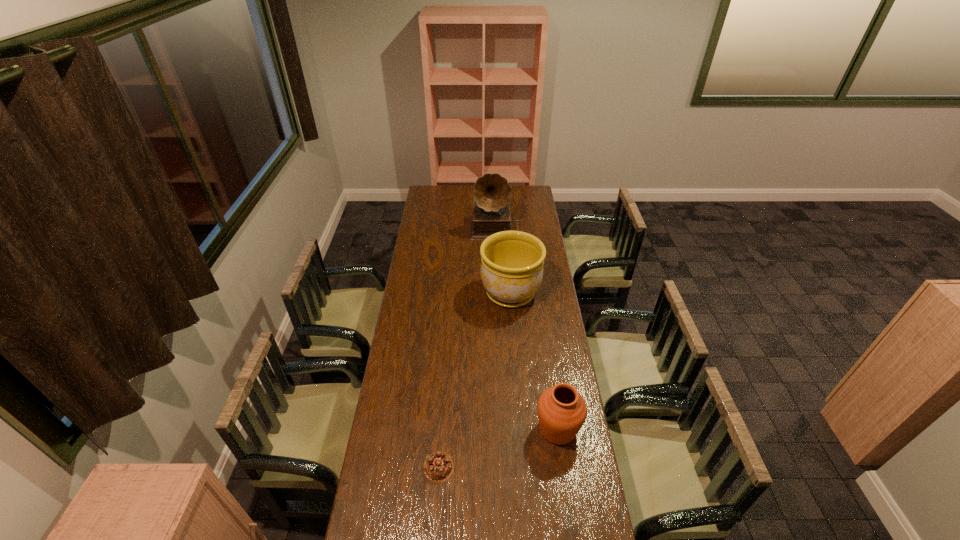
This screenshot has width=960, height=540. Identify the location of the farthest object. (491, 213).

Identify the location of record player. (491, 213).

Locate an element on the screen. flowerpot is located at coordinates [511, 270].

The height and width of the screenshot is (540, 960). What are the coordinates of `the third nearest object` in the screenshot? It's located at (511, 270).

I want to click on urn, so click(x=562, y=411).

This screenshot has height=540, width=960. In order to click on the third farthest object in this screenshot , I will do (x=562, y=411).

Image resolution: width=960 pixels, height=540 pixels. I want to click on the nearest object, so pos(438,467).

Find the location of a particular element. The image size is (960, 540). chocolate cake is located at coordinates (438, 467).

The height and width of the screenshot is (540, 960). In order to click on blank space located from the horn of the record player in this screenshot , I will do `click(498, 287)`.

I want to click on free space located on the left of the second farthest object, so click(444, 293).